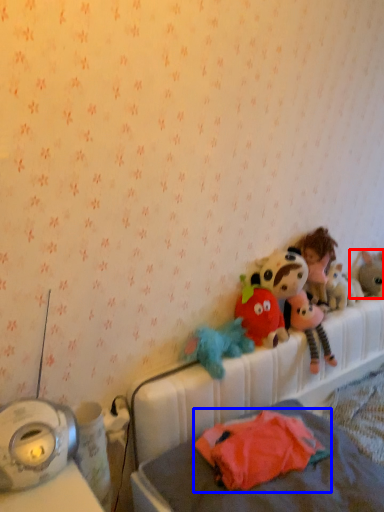
Question: Which point is further to the camera, toy (highlighted by a red box) or toy (highlighted by a blue box)?

Choices:
 (A) toy
 (B) toy

Answer: (A)